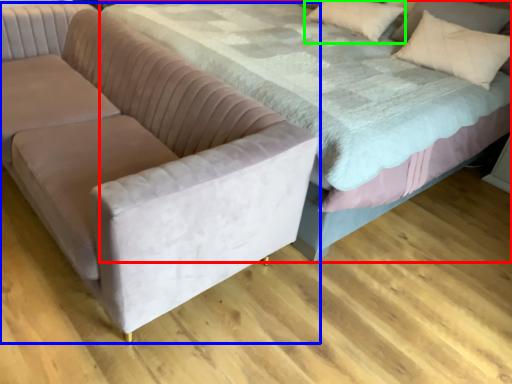
Question: Estimate the real-world distances between objects in this image. Which object is farther from bed (highlighted by a red box), studio couch (highlighted by a blue box) or pillow (highlighted by a green box)?

Choices:
 (A) studio couch
 (B) pillow

Answer: (B)